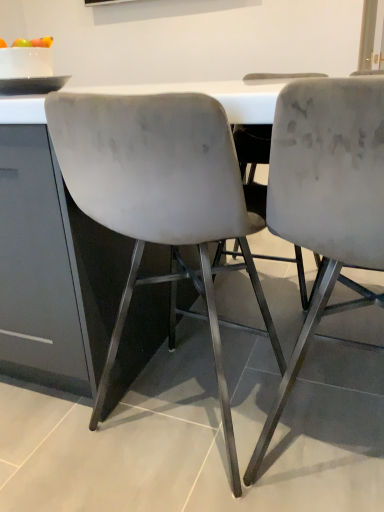
You are a GUI agent. You are given a task and a screenshot of the screen. Output one action in this format:
    pyautogui.click(x=<x>, y=<y>)
    Task: Click on the velvet gray chair at center, the 1th chair in the right-to-left sequence
    This screenshot has height=512, width=384.
    Given the screenshot: What is the action you would take?
    pyautogui.click(x=326, y=199)

The height and width of the screenshot is (512, 384). What do you see at coordinates (326, 199) in the screenshot?
I see `velvet gray chair at center, the 1th chair in the right-to-left sequence` at bounding box center [326, 199].

This screenshot has width=384, height=512. I want to click on matte gray chair at center, positioned as the 2th chair in right-to-left order, so (160, 198).

Measure the distance between matte gray chair at center, the 1th chair positioned from the left, and camera.

matte gray chair at center, the 1th chair positioned from the left, and camera are 27.43 inches apart.

In the scene shown: What is the approximate height of matte gray chair at center, the 1th chair positioned from the left?

matte gray chair at center, the 1th chair positioned from the left, is 36.75 inches in height.

What do you see at coordinates (160, 198) in the screenshot?
I see `matte gray chair at center, positioned as the 2th chair in right-to-left order` at bounding box center [160, 198].

I want to click on velvet gray chair at center, which ranks as the 2th chair in left-to-right order, so click(326, 199).

Which object is positioned more to the right, matte gray chair at center, the 1th chair positioned from the left, or velvet gray chair at center, which ranks as the 2th chair in left-to-right order?

From the viewer's perspective, velvet gray chair at center, which ranks as the 2th chair in left-to-right order, appears more on the right side.

Does matte gray chair at center, the 1th chair positioned from the left, lie in front of velvet gray chair at center, which ranks as the 2th chair in left-to-right order?

That is False.

Considering the points (184, 151) and (275, 141), which point is in front, point (184, 151) or point (275, 141)?

The point (275, 141) is closer to the camera.

From the image's perspective, between matte gray chair at center, positioned as the 2th chair in right-to-left order, and velvet gray chair at center, which ranks as the 2th chair in left-to-right order, which one is located above?

matte gray chair at center, positioned as the 2th chair in right-to-left order.

From a real-world perspective, which is physically below, matte gray chair at center, the 1th chair positioned from the left, or velvet gray chair at center, the 1th chair in the right-to-left sequence?

In real-world perspective, velvet gray chair at center, the 1th chair in the right-to-left sequence, is lower.

Considering the relative sizes of matte gray chair at center, positioned as the 2th chair in right-to-left order, and velvet gray chair at center, which ranks as the 2th chair in left-to-right order, in the image provided, is matte gray chair at center, positioned as the 2th chair in right-to-left order, thinner than velvet gray chair at center, which ranks as the 2th chair in left-to-right order,?

Indeed, matte gray chair at center, positioned as the 2th chair in right-to-left order, has a lesser width compared to velvet gray chair at center, which ranks as the 2th chair in left-to-right order.

Who is shorter, matte gray chair at center, positioned as the 2th chair in right-to-left order, or velvet gray chair at center, which ranks as the 2th chair in left-to-right order?

matte gray chair at center, positioned as the 2th chair in right-to-left order, is shorter.

Considering the relative sizes of matte gray chair at center, positioned as the 2th chair in right-to-left order, and velvet gray chair at center, the 1th chair in the right-to-left sequence, in the image provided, is matte gray chair at center, positioned as the 2th chair in right-to-left order, bigger than velvet gray chair at center, the 1th chair in the right-to-left sequence,?

Yes, matte gray chair at center, positioned as the 2th chair in right-to-left order, is bigger than velvet gray chair at center, the 1th chair in the right-to-left sequence.

Would you say matte gray chair at center, positioned as the 2th chair in right-to-left order, is inside or outside velvet gray chair at center, the 1th chair in the right-to-left sequence?

matte gray chair at center, positioned as the 2th chair in right-to-left order, is not inside velvet gray chair at center, the 1th chair in the right-to-left sequence, it's outside.

Is matte gray chair at center, positioned as the 2th chair in right-to-left order, far away from velvet gray chair at center, which ranks as the 2th chair in left-to-right order?

No, matte gray chair at center, positioned as the 2th chair in right-to-left order, is not far from velvet gray chair at center, which ranks as the 2th chair in left-to-right order.

Is matte gray chair at center, the 1th chair positioned from the left, facing away from velvet gray chair at center, the 1th chair in the right-to-left sequence?

No, matte gray chair at center, the 1th chair positioned from the left, is not facing the opposite direction of velvet gray chair at center, the 1th chair in the right-to-left sequence.

Can you tell me how much matte gray chair at center, positioned as the 2th chair in right-to-left order, and velvet gray chair at center, which ranks as the 2th chair in left-to-right order, differ in facing direction?

1.76 degrees separate the facing orientations of matte gray chair at center, positioned as the 2th chair in right-to-left order, and velvet gray chair at center, which ranks as the 2th chair in left-to-right order.

How distant is matte gray chair at center, the 1th chair positioned from the left, from velvet gray chair at center, the 1th chair in the right-to-left sequence?

matte gray chair at center, the 1th chair positioned from the left, is 9.47 inches away from velvet gray chair at center, the 1th chair in the right-to-left sequence.

Locate an element on the screen. chair above the velvet gray chair at center, which ranks as the 2th chair in left-to-right order (from a real-world perspective) is located at coordinates (160, 198).

Is velvet gray chair at center, which ranks as the 2th chair in left-to-right order, at the right side of matte gray chair at center, positioned as the 2th chair in right-to-left order?

Indeed, velvet gray chair at center, which ranks as the 2th chair in left-to-right order, is positioned on the right side of matte gray chair at center, positioned as the 2th chair in right-to-left order.

Which object is closer to the camera taking this photo, velvet gray chair at center, the 1th chair in the right-to-left sequence, or matte gray chair at center, positioned as the 2th chair in right-to-left order?

Positioned in front is velvet gray chair at center, the 1th chair in the right-to-left sequence.

Considering the points (370, 173) and (129, 105), which point is in front, point (370, 173) or point (129, 105)?

The point (370, 173) is closer to the camera.

From the image's perspective, which is below, velvet gray chair at center, which ranks as the 2th chair in left-to-right order, or matte gray chair at center, the 1th chair positioned from the left?

velvet gray chair at center, which ranks as the 2th chair in left-to-right order, appears lower in the image.

From a real-world perspective, is velvet gray chair at center, the 1th chair in the right-to-left sequence, above or below matte gray chair at center, positioned as the 2th chair in right-to-left order?

velvet gray chair at center, the 1th chair in the right-to-left sequence, is below matte gray chair at center, positioned as the 2th chair in right-to-left order.

Which object is thinner, velvet gray chair at center, the 1th chair in the right-to-left sequence, or matte gray chair at center, positioned as the 2th chair in right-to-left order?

With smaller width is matte gray chair at center, positioned as the 2th chair in right-to-left order.

Is velvet gray chair at center, which ranks as the 2th chair in left-to-right order, taller or shorter than matte gray chair at center, the 1th chair positioned from the left?

velvet gray chair at center, which ranks as the 2th chair in left-to-right order, is taller than matte gray chair at center, the 1th chair positioned from the left.

Can you confirm if velvet gray chair at center, the 1th chair in the right-to-left sequence, is smaller than matte gray chair at center, the 1th chair positioned from the left?

Yes, velvet gray chair at center, the 1th chair in the right-to-left sequence, is smaller than matte gray chair at center, the 1th chair positioned from the left.

Is velvet gray chair at center, which ranks as the 2th chair in left-to-right order, surrounding matte gray chair at center, the 1th chair positioned from the left?

That's incorrect, matte gray chair at center, the 1th chair positioned from the left, is not inside velvet gray chair at center, which ranks as the 2th chair in left-to-right order.

Are velvet gray chair at center, the 1th chair in the right-to-left sequence, and matte gray chair at center, the 1th chair positioned from the left, far apart?

No, velvet gray chair at center, the 1th chair in the right-to-left sequence, is in close proximity to matte gray chair at center, the 1th chair positioned from the left.

Does velvet gray chair at center, the 1th chair in the right-to-left sequence, turn towards matte gray chair at center, the 1th chair positioned from the left?

No, velvet gray chair at center, the 1th chair in the right-to-left sequence, is not facing towards matte gray chair at center, the 1th chair positioned from the left.

Identify the location of chair on the right of matte gray chair at center, the 1th chair positioned from the left. This screenshot has height=512, width=384. (326, 199).

In order to click on chair behind the velvet gray chair at center, the 1th chair in the right-to-left sequence in this screenshot , I will do `click(160, 198)`.

Where is `chair on the right of the matte gray chair at center, the 1th chair positioned from the left`? chair on the right of the matte gray chair at center, the 1th chair positioned from the left is located at coordinates (326, 199).